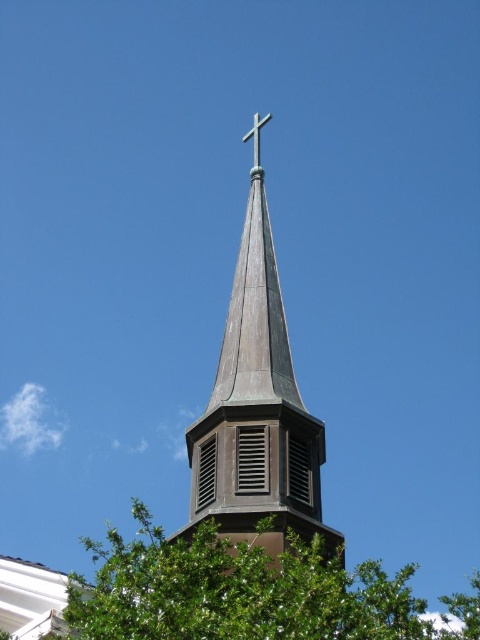
This screenshot has height=640, width=480. What do you see at coordinates (249, 592) in the screenshot?
I see `green leafy tree at center` at bounding box center [249, 592].

Is green leafy tree at center thinner than metallic cross at upper center?

No.

Is point (204, 532) positioned before point (265, 115)?

Yes, point (204, 532) is closer to viewer.

Where is `green leafy tree at center`? green leafy tree at center is located at coordinates [x=249, y=592].

Is point (252, 294) closer to camera compared to point (242, 141)?

That is True.

Does shiny copper steeple at center appear on the right side of metallic cross at upper center?

No, shiny copper steeple at center is not to the right of metallic cross at upper center.

Where is `shiny copper steeple at center`? The image size is (480, 640). shiny copper steeple at center is located at coordinates (256, 412).

Does green leafy tree at center have a lesser width compared to shiny copper steeple at center?

In fact, green leafy tree at center might be wider than shiny copper steeple at center.

Which is in front, point (104, 563) or point (247, 378)?

Point (247, 378) is in front.

This screenshot has height=640, width=480. What do you see at coordinates (249, 592) in the screenshot?
I see `green leafy tree at center` at bounding box center [249, 592].

Image resolution: width=480 pixels, height=640 pixels. In order to click on green leafy tree at center in this screenshot , I will do `click(249, 592)`.